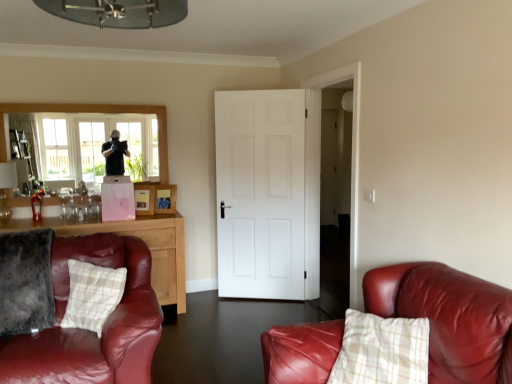
Identify the location of free spot above clear glass window at upper left (from a real-world perspective). (81, 106).